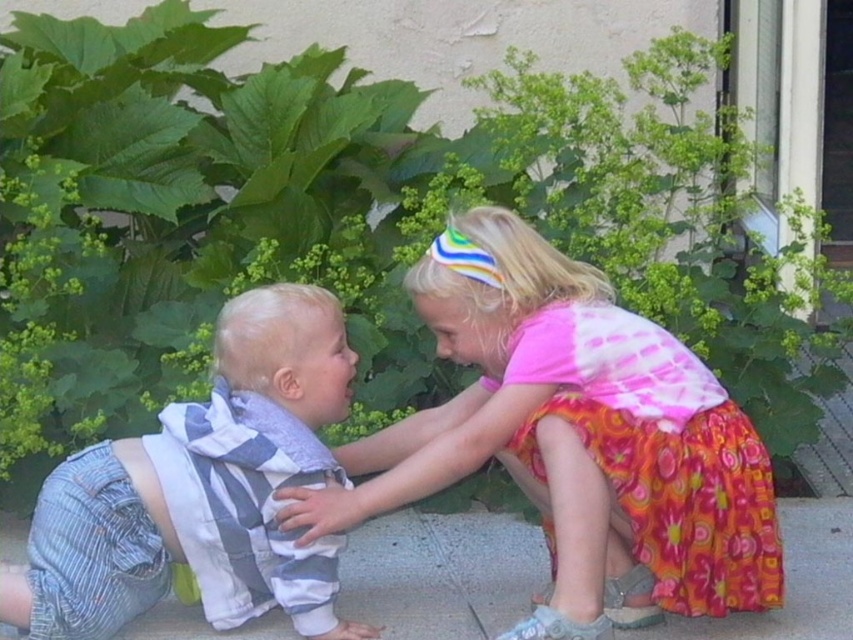
You are a photographer setting up for a photoshoot in a garden. You have two dresses to display. The multicolored fabric dress at center and the floral cotton dress at lower right. Based on their sizes, which dress should you place in the foreground to ensure it stands out more in the photo?

The multicolored fabric dress at center is taller than the floral cotton dress at lower right, so placing the multicolored fabric dress at center in the foreground will make it stand out more due to its larger size.

You are a photographer setting up a shoot in a garden. You need to place a large backdrop behind the multicolored fabric dress at center and the striped cotton shirt at lower left. Since you want the backdrop to cover both items without overlapping them, which object requires a wider section of the backdrop?

The multicolored fabric dress at center requires a wider section of the backdrop because its width surpasses that of the striped cotton shirt at lower left.

In the scene shown: You are a photographer setting up for a family portrait. You need to position two children so that their outfits, the multicolored fabric dress at center and the striped cotton shirt at lower left, are clearly visible. Given their current positions, is there enough space between them to ensure both outfits are fully visible in the photo?

The multicolored fabric dress at center and the striped cotton shirt at lower left are 17.00 inches apart from each other. This distance should provide sufficient space to capture both outfits clearly in the photo without overlapping.